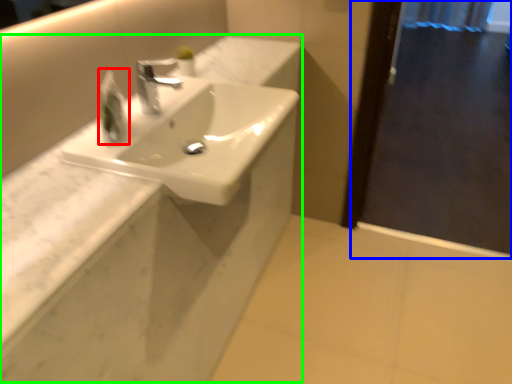
Question: Which object is positioned farthest from soap dispenser (highlighted by a red box)? Select from screen door (highlighted by a blue box) and counter (highlighted by a green box).

Choices:
 (A) screen door
 (B) counter

Answer: (A)